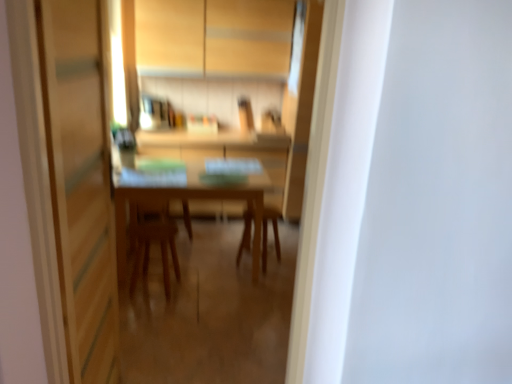
Question: Is wooden table at center aimed at wooden chair at center?

Choices:
 (A) no
 (B) yes

Answer: (B)

Question: From the image's perspective, is wooden table at center below wooden chair at center?

Choices:
 (A) yes
 (B) no

Answer: (B)

Question: Does wooden table at center lie in front of wooden chair at center?

Choices:
 (A) yes
 (B) no

Answer: (A)

Question: Is wooden table at center next to wooden chair at center and touching it?

Choices:
 (A) yes
 (B) no

Answer: (B)

Question: Is there a large distance between wooden table at center and wooden chair at center?

Choices:
 (A) yes
 (B) no

Answer: (B)

Question: Is wooden chair at center spatially inside transparent glass screen door at left, or outside of it?

Choices:
 (A) inside
 (B) outside

Answer: (B)

Question: In the image, is wooden chair at center positioned in front of or behind transparent glass screen door at left?

Choices:
 (A) front
 (B) behind

Answer: (B)

Question: Is wooden chair at center wider or thinner than transparent glass screen door at left?

Choices:
 (A) thin
 (B) wide

Answer: (B)

Question: In terms of size, does wooden chair at center appear bigger or smaller than transparent glass screen door at left?

Choices:
 (A) big
 (B) small

Answer: (B)

Question: Is matte wood cabinetry at upper center in front of or behind wooden chair at center in the image?

Choices:
 (A) behind
 (B) front

Answer: (A)

Question: Is matte wood cabinetry at upper center bigger or smaller than wooden chair at center?

Choices:
 (A) small
 (B) big

Answer: (B)

Question: Is point (290, 16) closer or farther from the camera than point (138, 215)?

Choices:
 (A) farther
 (B) closer

Answer: (A)

Question: Considering the relative positions of matte wood cabinetry at upper center and wooden chair at center in the image provided, is matte wood cabinetry at upper center to the left or to the right of wooden chair at center?

Choices:
 (A) right
 (B) left

Answer: (A)

Question: Is matte wood cabinetry at upper center to the left or to the right of wooden chair at center in the image?

Choices:
 (A) right
 (B) left

Answer: (B)

Question: Considering their positions, is matte wood cabinetry at upper center located in front of or behind wooden chair at center?

Choices:
 (A) behind
 (B) front

Answer: (A)